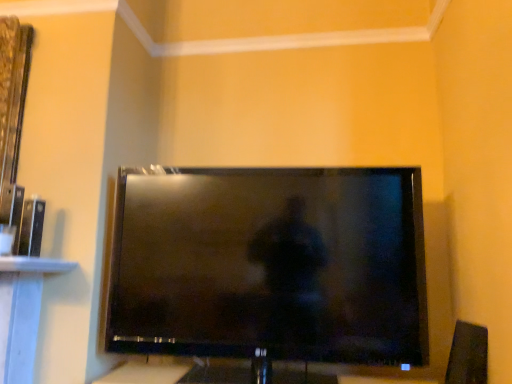
Question: Does point (408, 291) appear closer or farther from the camera than point (457, 327)?

Choices:
 (A) closer
 (B) farther

Answer: (A)

Question: From the image's perspective, relative to black plastic speaker at lower right, is black glossy tv at center above or below?

Choices:
 (A) below
 (B) above

Answer: (B)

Question: Considering their positions, is black glossy tv at center located in front of or behind black plastic speaker at lower right?

Choices:
 (A) front
 (B) behind

Answer: (A)

Question: Is point (472, 377) positioned closer to the camera than point (361, 201)?

Choices:
 (A) closer
 (B) farther

Answer: (A)

Question: In terms of size, does black plastic speaker at lower right appear bigger or smaller than black glossy tv at center?

Choices:
 (A) big
 (B) small

Answer: (B)

Question: Looking at their shapes, would you say black plastic speaker at lower right is wider or thinner than black glossy tv at center?

Choices:
 (A) thin
 (B) wide

Answer: (A)

Question: From a real-world perspective, relative to black glossy tv at center, is black plastic speaker at lower right vertically above or below?

Choices:
 (A) above
 (B) below

Answer: (B)